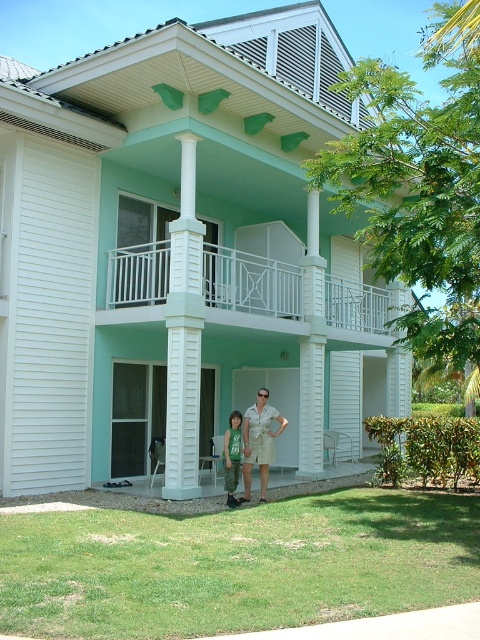
Question: Which is farther from the white matte balcony at upper center?

Choices:
 (A) khaki shorts at center
 (B) green cotton shirt at center
 (C) white painted wood column at center
 (D) white smooth column at center

Answer: (B)

Question: Which of the following is the closest to the observer?

Choices:
 (A) (276, 330)
 (B) (275, 410)

Answer: (B)

Question: Observing the image, what is the correct spatial positioning of white matte balcony at upper center in reference to white painted wood column at center?

Choices:
 (A) left
 (B) right

Answer: (B)

Question: Among these points, which one is nearest to the camera?

Choices:
 (A) (239, 433)
 (B) (364, 330)

Answer: (A)

Question: Can you confirm if white painted wood column at center is wider than green cotton shirt at center?

Choices:
 (A) no
 (B) yes

Answer: (B)

Question: Is white painted wood column at center behind white smooth column at center?

Choices:
 (A) yes
 (B) no

Answer: (B)